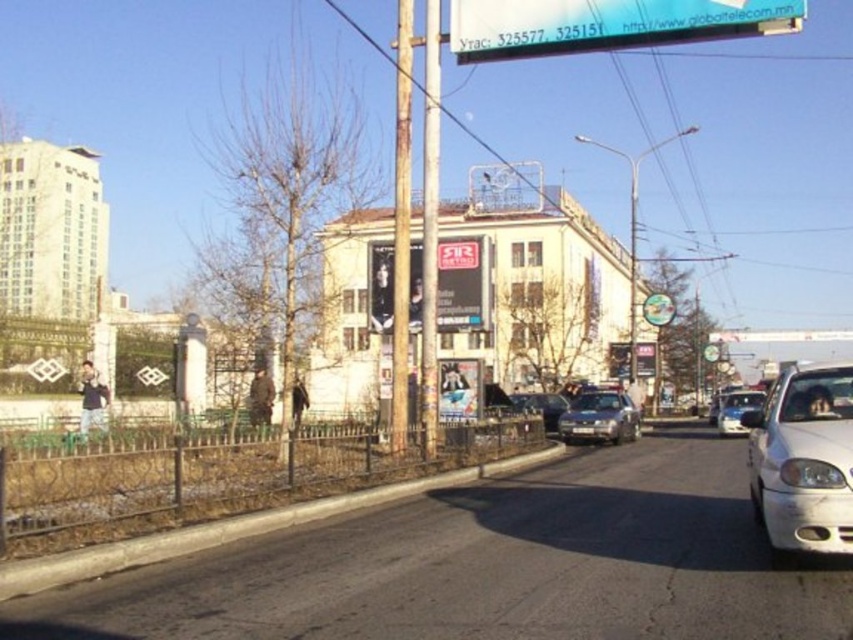
Question: Considering the relative positions of rusty wood pole at center and metallic pole at center in the image provided, where is rusty wood pole at center located with respect to metallic pole at center?

Choices:
 (A) left
 (B) right

Answer: (A)

Question: Observing the image, what is the correct spatial positioning of white matte car at lower right in reference to metallic silver sedan at center?

Choices:
 (A) above
 (B) below

Answer: (A)

Question: Is white matte car at lower right positioned in front of white glossy sedan at center-right?

Choices:
 (A) no
 (B) yes

Answer: (B)

Question: Which of the following is the farthest from the observer?

Choices:
 (A) (432, 51)
 (B) (564, 440)
 (C) (410, 150)

Answer: (B)

Question: Estimate the real-world distances between objects in this image. Which object is farther from the transparent plastic sign at upper center?

Choices:
 (A) metallic pole at center
 (B) metallic silver sedan at center
 (C) black plastic license plate at center

Answer: (B)

Question: Which point is farther from the camera taking this photo?

Choices:
 (A) tap(578, 417)
 (B) tap(775, 32)

Answer: (A)